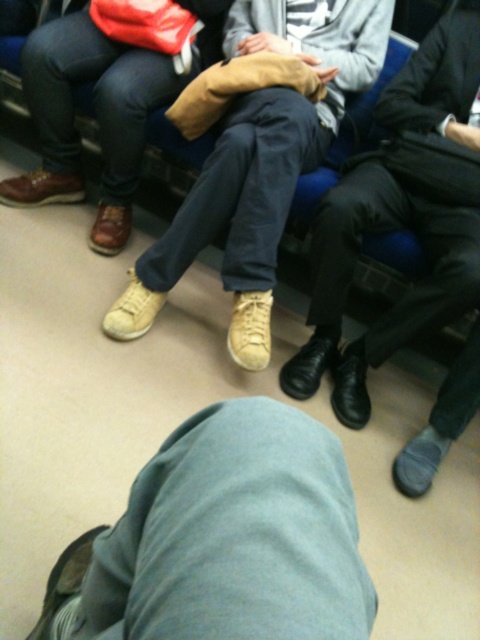
Question: Can you confirm if leather shoes at center is positioned to the right of leather sneakers at center?

Choices:
 (A) no
 (B) yes

Answer: (B)

Question: Is leather sneakers at center above tan suede shoes at center?

Choices:
 (A) no
 (B) yes

Answer: (A)

Question: Estimate the real-world distances between objects in this image. Which object is farther from the leather shoes at center?

Choices:
 (A) gray fabric pants at lower center
 (B) leather sneakers at center

Answer: (A)

Question: Which is farther from the gray fabric pants at lower center?

Choices:
 (A) leather sneakers at center
 (B) tan suede shoes at center
 (C) leather shoes at center

Answer: (B)

Question: Among these points, which one is farthest from the camera?

Choices:
 (A) (313, 273)
 (B) (336, 605)
 (C) (24, 205)
 (D) (324, 131)

Answer: (C)

Question: Is the position of gray fabric pants at lower center less distant than that of tan suede shoes at center?

Choices:
 (A) no
 (B) yes

Answer: (B)